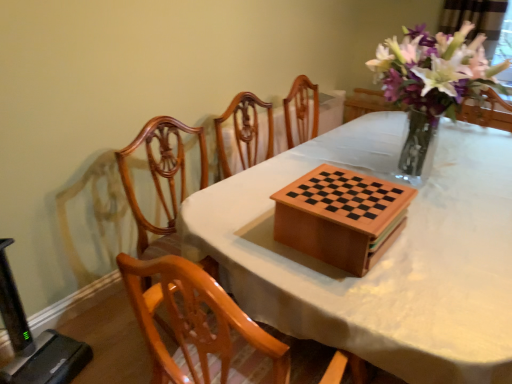
Question: Is translucent glass vase at upper right positioned beyond the bounds of polished wood chair at center?

Choices:
 (A) no
 (B) yes

Answer: (B)

Question: Does translucent glass vase at upper right come behind polished wood chair at center?

Choices:
 (A) yes
 (B) no

Answer: (A)

Question: Can you confirm if translucent glass vase at upper right is wider than polished wood chair at center?

Choices:
 (A) yes
 (B) no

Answer: (B)

Question: Is translucent glass vase at upper right positioned far away from polished wood chair at center?

Choices:
 (A) no
 (B) yes

Answer: (B)

Question: Is translucent glass vase at upper right placed right next to polished wood chair at center?

Choices:
 (A) yes
 (B) no

Answer: (B)

Question: In the image, is translucent glass vase at upper right positioned in front of or behind wooden table at center?

Choices:
 (A) behind
 (B) front

Answer: (A)

Question: Considering the relative positions of translucent glass vase at upper right and wooden table at center in the image provided, is translucent glass vase at upper right to the left or to the right of wooden table at center?

Choices:
 (A) left
 (B) right

Answer: (B)

Question: From a real-world perspective, relative to wooden table at center, is translucent glass vase at upper right vertically above or below?

Choices:
 (A) above
 (B) below

Answer: (A)

Question: Do you think translucent glass vase at upper right is within wooden table at center, or outside of it?

Choices:
 (A) outside
 (B) inside

Answer: (A)

Question: Considering the positions of wooden chess set at center and wooden table at center in the image, is wooden chess set at center taller or shorter than wooden table at center?

Choices:
 (A) short
 (B) tall

Answer: (A)

Question: Considering the positions of wooden chess set at center and wooden table at center in the image, is wooden chess set at center wider or thinner than wooden table at center?

Choices:
 (A) wide
 (B) thin

Answer: (B)

Question: From a real-world perspective, is wooden chess set at center physically located above or below wooden table at center?

Choices:
 (A) above
 (B) below

Answer: (A)

Question: From the image's perspective, is wooden chess set at center positioned above or below wooden table at center?

Choices:
 (A) above
 (B) below

Answer: (A)

Question: In the image, is wooden chess set at center on the left side or the right side of polished wood chair at center?

Choices:
 (A) left
 (B) right

Answer: (B)

Question: Considering the positions of point (218, 127) and point (194, 127), is point (218, 127) closer or farther from the camera than point (194, 127)?

Choices:
 (A) farther
 (B) closer

Answer: (A)